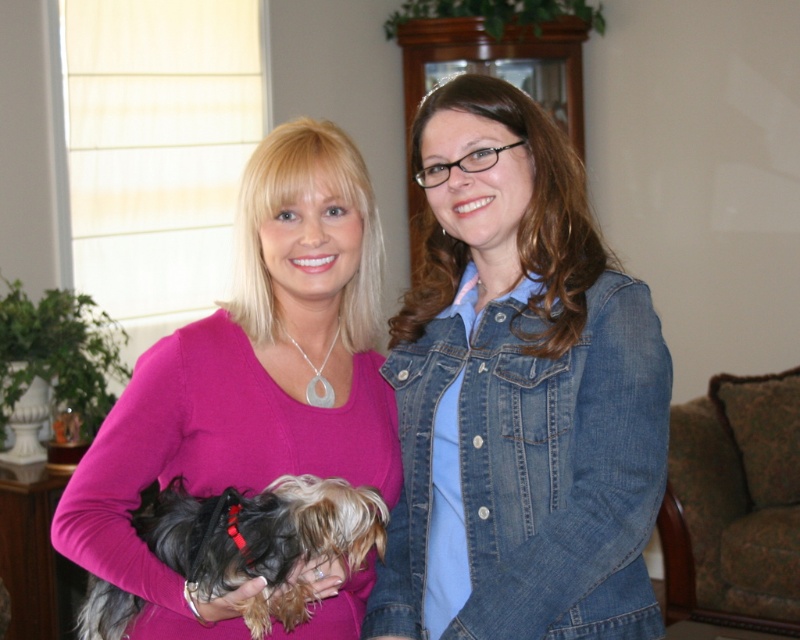
Question: Which of the following is the farthest from the observer?

Choices:
 (A) green floral fabric armchair at lower right
 (B) pink matte sweater at center
 (C) fluffy brown dog at center
 (D) denim jacket at center

Answer: (A)

Question: Is pink matte sweater at center positioned before fluffy brown dog at center?

Choices:
 (A) yes
 (B) no

Answer: (B)

Question: Is denim jacket at center wider than fluffy brown dog at center?

Choices:
 (A) yes
 (B) no

Answer: (B)

Question: Which object appears farthest from the camera in this image?

Choices:
 (A) green floral fabric armchair at lower right
 (B) pink matte sweater at center

Answer: (A)

Question: Does denim jacket at center have a larger size compared to fluffy brown dog at center?

Choices:
 (A) no
 (B) yes

Answer: (B)

Question: Which point appears closest to the camera in this image?

Choices:
 (A) (449, 284)
 (B) (320, 243)

Answer: (B)